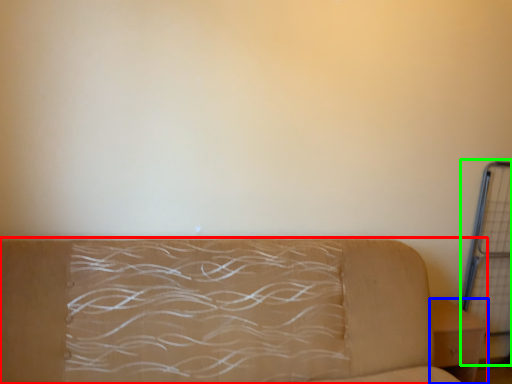
Question: Which object is positioned farthest from studio couch (highlighted by a red box)? Select from furniture (highlighted by a blue box) and cage (highlighted by a green box).

Choices:
 (A) furniture
 (B) cage

Answer: (B)